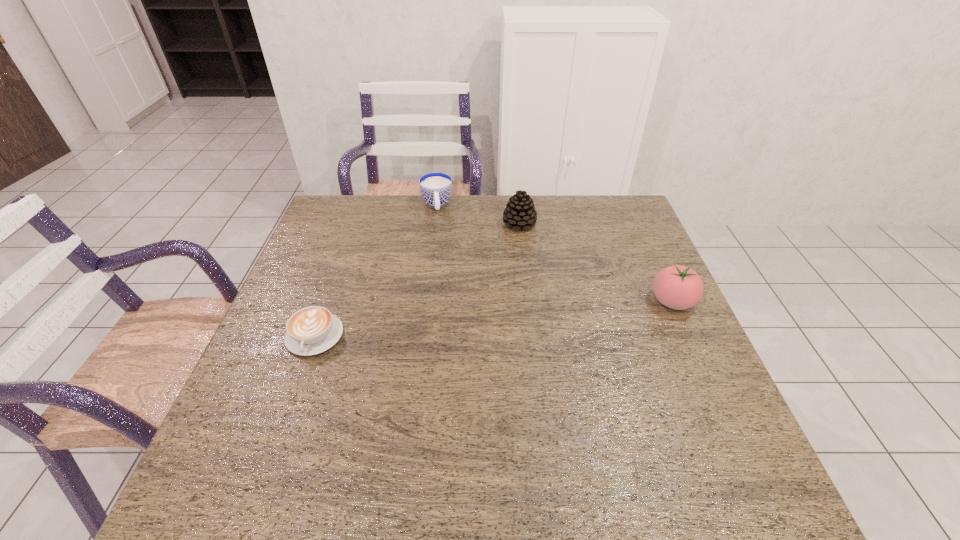
Find the location of a particular element. This screenshot has width=960, height=540. vacant space at the left edge of the desktop is located at coordinates (348, 261).

In order to click on free spot at the right edge of the desktop in this screenshot , I will do [676, 375].

Identify the location of vacant space at the far left corner. (348, 233).

The width and height of the screenshot is (960, 540). In order to click on free region at the far right corner of the desktop in this screenshot , I will do `click(627, 214)`.

The height and width of the screenshot is (540, 960). I want to click on vacant area between the cappuccino and the second object from left to right, so click(x=375, y=271).

Where is `vacant space that is in between the rightmost object and the second object from right to left`? vacant space that is in between the rightmost object and the second object from right to left is located at coordinates (596, 262).

At what (x,y) coordinates should I click in order to perform the action: click on vacant space that is in between the third object from left to right and the tomato. Please return your answer as a coordinate pair (x, y). This screenshot has width=960, height=540. Looking at the image, I should click on (596, 262).

At what (x,y) coordinates should I click in order to perform the action: click on blank region between the cup and the rightmost object. Please return your answer as a coordinate pair (x, y). The height and width of the screenshot is (540, 960). Looking at the image, I should click on (555, 253).

This screenshot has width=960, height=540. What are the coordinates of `empty space that is in between the tomato and the leftmost object` in the screenshot? It's located at (493, 319).

Identify the location of free area in between the second object from left to right and the third object from left to right. (478, 214).